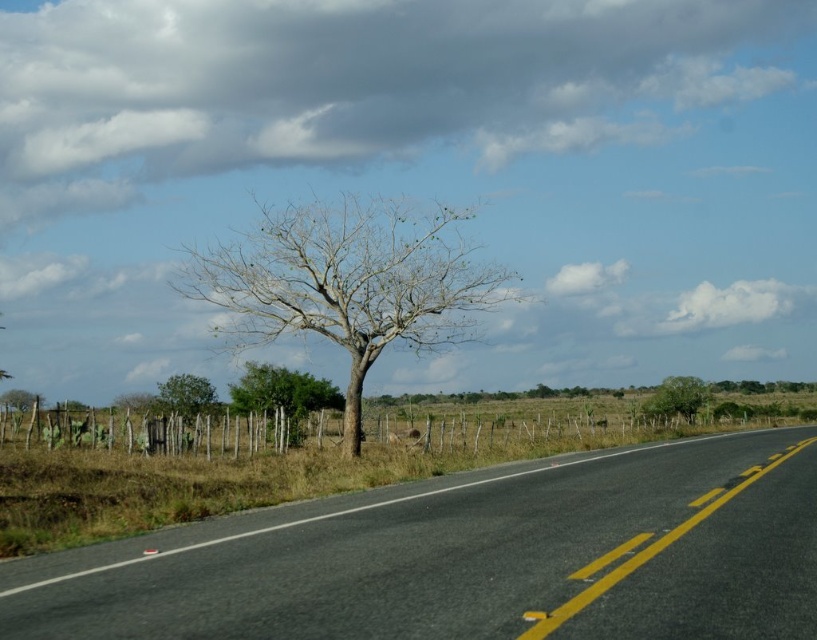
Question: Is black asphalt road at center smaller than bare wood tree at center?

Choices:
 (A) yes
 (B) no

Answer: (A)

Question: Estimate the real-world distances between objects in this image. Which object is closer to the green leafy tree at center?

Choices:
 (A) green leafy tree at right
 (B) green leafy bush at lower left
 (C) bare wood tree at left

Answer: (B)

Question: Estimate the real-world distances between objects in this image. Which object is closer to the green leafy tree at center?

Choices:
 (A) black asphalt road at center
 (B) bare wood tree at left
 (C) bare wood tree at center
 (D) green leafy bush at lower left

Answer: (D)

Question: Which point is farther from the camera taking this photo?

Choices:
 (A) (693, 417)
 (B) (28, 401)
 (C) (744, 588)

Answer: (B)

Question: Is bare wood tree at center above green leafy tree at center?

Choices:
 (A) yes
 (B) no

Answer: (A)

Question: Can you confirm if bare wood tree at center is positioned above green leafy tree at center?

Choices:
 (A) yes
 (B) no

Answer: (A)